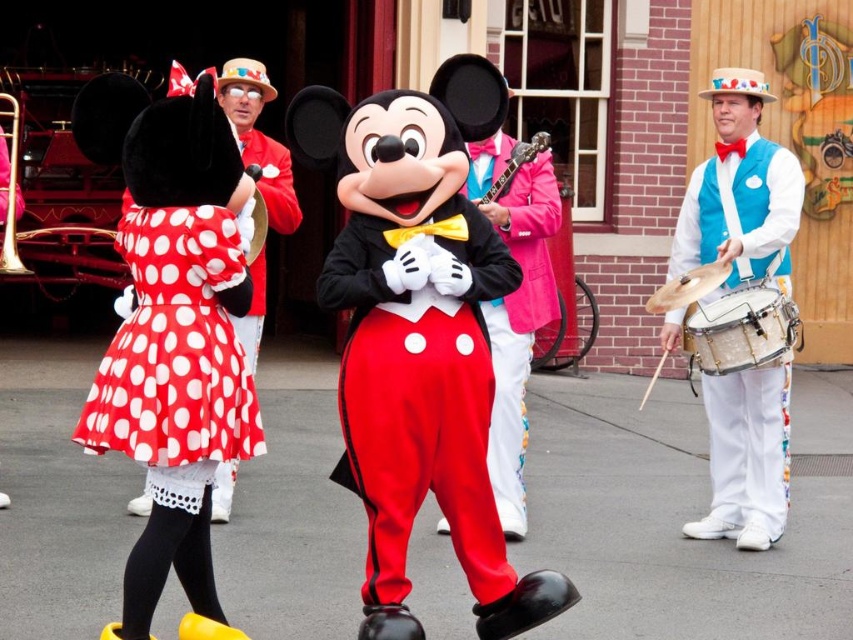
Question: Based on their relative distances, which object is nearer to the shiny silver cymbal at right?

Choices:
 (A) white polka dot dress at center
 (B) polka dot fabric dress at left
 (C) glossy wood guitar at center

Answer: (C)

Question: Based on their relative distances, which object is farther from the matte red pants at center?

Choices:
 (A) white polka dot dress at center
 (B) polka dot fabric dress at left
 (C) blue velvet vest at right
 (D) matte black bow tie at center

Answer: (C)

Question: Can you confirm if matte red pants at center is bigger than blue velvet vest at right?

Choices:
 (A) yes
 (B) no

Answer: (A)

Question: Where is white polka dot dress at center located in relation to glossy wood guitar at center in the image?

Choices:
 (A) above
 (B) below

Answer: (B)

Question: Is matte black bow tie at center closer to camera compared to shiny silver cymbal at right?

Choices:
 (A) yes
 (B) no

Answer: (B)

Question: Which object is farther from the camera taking this photo?

Choices:
 (A) matte black bow tie at center
 (B) white polka dot dress at center
 (C) white leather drum at right

Answer: (B)